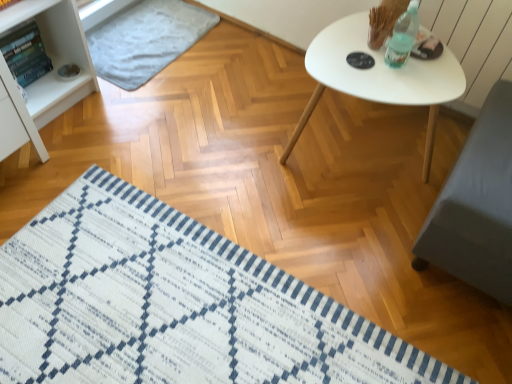
In order to click on free space in front of light gray textured mat at upper left, acting as the first mat starting from the back in this screenshot , I will do `click(148, 117)`.